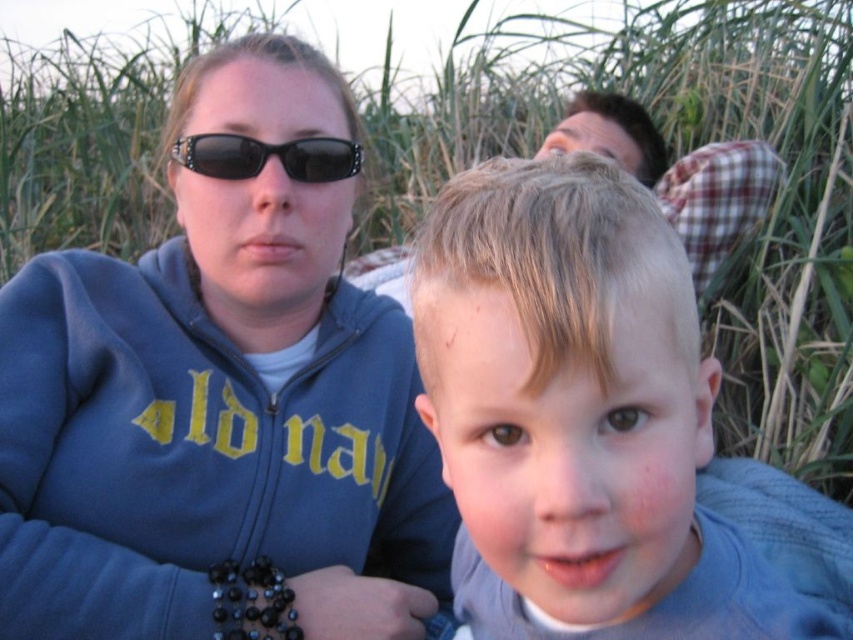
Does blue fleece jacket at upper left have a greater width compared to light brown hair at center?

Yes.

What do you see at coordinates (219, 404) in the screenshot? This screenshot has height=640, width=853. I see `blue fleece jacket at upper left` at bounding box center [219, 404].

Who is more distant from viewer, (299, 563) or (596, 499)?

The point (299, 563) is more distant.

Where is `blue fleece jacket at upper left`? Image resolution: width=853 pixels, height=640 pixels. blue fleece jacket at upper left is located at coordinates [x=219, y=404].

Can you confirm if light brown hair at center is shorter than black plastic sunglasses at upper center?

No.

At what (x,y) coordinates should I click in order to perform the action: click on light brown hair at center. Please return your answer as a coordinate pair (x, y). This screenshot has width=853, height=640. Looking at the image, I should click on (578, 416).

Which is below, blue fleece jacket at upper left or black plastic sunglasses at upper center?

blue fleece jacket at upper left

Is blue fleece jacket at upper left thinner than black plastic sunglasses at upper center?

No, blue fleece jacket at upper left is not thinner than black plastic sunglasses at upper center.

Which is in front, point (340, 444) or point (292, 168)?

Point (292, 168) is more forward.

Identify the location of blue fleece jacket at upper left. (219, 404).